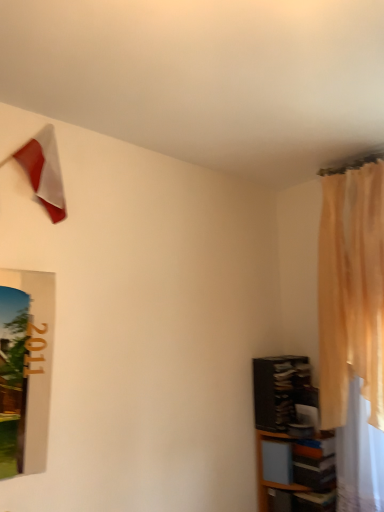
In order to click on black glossy shelf at lower right, placed as the 1th shelf when sorted from top to bottom in this screenshot , I will do `click(281, 390)`.

What do you see at coordinates (44, 170) in the screenshot?
I see `matte red flag at upper left` at bounding box center [44, 170].

I want to click on light beige sheer curtain at right, so click(351, 291).

Image resolution: width=384 pixels, height=512 pixels. In order to click on black glossy shelf at lower right, which is counted as the second shelf, starting from the bottom in this screenshot , I will do `click(281, 390)`.

Is the position of wooden shelf at lower right, the 1th shelf from the bottom, more distant than that of matte red flag at upper left?

Yes, wooden shelf at lower right, the 1th shelf from the bottom, is further from the camera.

The image size is (384, 512). In order to click on shelf that is the 2nd one when counting rightward from the matte red flag at upper left in this screenshot , I will do `click(291, 438)`.

Does point (272, 375) lie behind point (38, 135)?

Yes, point (272, 375) is farther from viewer.

From a real-world perspective, which object stands above the other?

matte red flag at upper left.

Based on their sizes in the image, would you say light beige sheer curtain at right is bigger or smaller than wooden shelf at lower right, the 1th shelf from the bottom?

Clearly, light beige sheer curtain at right is larger in size than wooden shelf at lower right, the 1th shelf from the bottom.

From the image's perspective, between light beige sheer curtain at right and wooden shelf at lower right, the 1th shelf from the bottom, who is located below?

From the image's view, wooden shelf at lower right, the 1th shelf from the bottom, is below.

Is light beige sheer curtain at right not close to wooden shelf at lower right, marked as the second shelf in a top-to-bottom arrangement?

No.

Which object is positioned more to the right, light beige sheer curtain at right or wooden shelf at lower right, the 1th shelf from the bottom?

light beige sheer curtain at right is more to the right.

Considering the positions of objects black glossy shelf at lower right, which is counted as the second shelf, starting from the bottom, and wooden shelf at lower right, the 1th shelf from the bottom, in the image provided, who is more to the right, black glossy shelf at lower right, which is counted as the second shelf, starting from the bottom, or wooden shelf at lower right, the 1th shelf from the bottom,?

wooden shelf at lower right, the 1th shelf from the bottom, is more to the right.

From the image's perspective, is black glossy shelf at lower right, placed as the 1th shelf when sorted from top to bottom, above wooden shelf at lower right, marked as the second shelf in a top-to-bottom arrangement?

Yes, from the image's perspective, black glossy shelf at lower right, placed as the 1th shelf when sorted from top to bottom, is above wooden shelf at lower right, marked as the second shelf in a top-to-bottom arrangement.

From a real-world perspective, between black glossy shelf at lower right, placed as the 1th shelf when sorted from top to bottom, and wooden shelf at lower right, the 1th shelf from the bottom, who is vertically lower?

wooden shelf at lower right, the 1th shelf from the bottom, from a real-world perspective.

Is black glossy shelf at lower right, placed as the 1th shelf when sorted from top to bottom, next to wooden shelf at lower right, marked as the second shelf in a top-to-bottom arrangement, and touching it?

Yes, black glossy shelf at lower right, placed as the 1th shelf when sorted from top to bottom, is next to wooden shelf at lower right, marked as the second shelf in a top-to-bottom arrangement.

Considering the relative sizes of light beige sheer curtain at right and black glossy shelf at lower right, placed as the 1th shelf when sorted from top to bottom, in the image provided, is light beige sheer curtain at right bigger than black glossy shelf at lower right, placed as the 1th shelf when sorted from top to bottom,?

Yes.

Considering the sizes of objects light beige sheer curtain at right and black glossy shelf at lower right, which is counted as the second shelf, starting from the bottom, in the image provided, who is thinner, light beige sheer curtain at right or black glossy shelf at lower right, which is counted as the second shelf, starting from the bottom,?

light beige sheer curtain at right is thinner.

Considering the sizes of light beige sheer curtain at right and black glossy shelf at lower right, which is counted as the second shelf, starting from the bottom, in the image, is light beige sheer curtain at right taller or shorter than black glossy shelf at lower right, which is counted as the second shelf, starting from the bottom,?

Clearly, light beige sheer curtain at right is taller compared to black glossy shelf at lower right, which is counted as the second shelf, starting from the bottom.

Visually, is light beige sheer curtain at right positioned to the left or to the right of black glossy shelf at lower right, placed as the 1th shelf when sorted from top to bottom?

Clearly, light beige sheer curtain at right is on the right of black glossy shelf at lower right, placed as the 1th shelf when sorted from top to bottom, in the image.

From the picture: Considering the positions of objects matte red flag at upper left and light beige sheer curtain at right in the image provided, who is more to the right, matte red flag at upper left or light beige sheer curtain at right?

light beige sheer curtain at right is more to the right.

Can you confirm if matte red flag at upper left is thinner than light beige sheer curtain at right?

Yes.

Does matte red flag at upper left have a smaller size compared to light beige sheer curtain at right?

Yes.

Which object is positioned more to the left, wooden shelf at lower right, the 1th shelf from the bottom, or light beige sheer curtain at right?

Positioned to the left is wooden shelf at lower right, the 1th shelf from the bottom.

Is wooden shelf at lower right, the 1th shelf from the bottom, spatially inside light beige sheer curtain at right, or outside of it?

wooden shelf at lower right, the 1th shelf from the bottom, is spatially situated outside light beige sheer curtain at right.

Could you measure the distance between wooden shelf at lower right, the 1th shelf from the bottom, and light beige sheer curtain at right?

wooden shelf at lower right, the 1th shelf from the bottom, is 17.07 inches from light beige sheer curtain at right.

Can you confirm if light beige sheer curtain at right is wider than matte red flag at upper left?

Yes.

Is light beige sheer curtain at right not close to matte red flag at upper left?

Absolutely, light beige sheer curtain at right is distant from matte red flag at upper left.

Visually, is light beige sheer curtain at right positioned to the left or to the right of matte red flag at upper left?

Clearly, light beige sheer curtain at right is on the right of matte red flag at upper left in the image.

Consider the image. Does light beige sheer curtain at right have a larger size compared to matte red flag at upper left?

Yes.

Where is `flag that is in front of the wooden shelf at lower right, marked as the second shelf in a top-to-bottom arrangement`? The image size is (384, 512). flag that is in front of the wooden shelf at lower right, marked as the second shelf in a top-to-bottom arrangement is located at coordinates (44, 170).

This screenshot has width=384, height=512. Find the location of `shelf that is the 1st object to the left of the light beige sheer curtain at right, starting at the anchor`. shelf that is the 1st object to the left of the light beige sheer curtain at right, starting at the anchor is located at coordinates (291, 438).

Looking at the image, which one is located further to black glossy shelf at lower right, placed as the 1th shelf when sorted from top to bottom, light beige sheer curtain at right or wooden shelf at lower right, marked as the second shelf in a top-to-bottom arrangement?

light beige sheer curtain at right.

Based on their spatial positions, is matte red flag at upper left or light beige sheer curtain at right closer to black glossy shelf at lower right, placed as the 1th shelf when sorted from top to bottom?

light beige sheer curtain at right.

Which object lies further to the anchor point light beige sheer curtain at right, wooden shelf at lower right, marked as the second shelf in a top-to-bottom arrangement, or matte red flag at upper left?

Among the two, matte red flag at upper left is located further to light beige sheer curtain at right.

Based on their spatial positions, is black glossy shelf at lower right, which is counted as the second shelf, starting from the bottom, or matte red flag at upper left closer to wooden shelf at lower right, marked as the second shelf in a top-to-bottom arrangement?

Based on the image, black glossy shelf at lower right, which is counted as the second shelf, starting from the bottom, appears to be nearer to wooden shelf at lower right, marked as the second shelf in a top-to-bottom arrangement.

Which object lies further to the anchor point matte red flag at upper left, light beige sheer curtain at right or wooden shelf at lower right, marked as the second shelf in a top-to-bottom arrangement?

wooden shelf at lower right, marked as the second shelf in a top-to-bottom arrangement, is further to matte red flag at upper left.

Based on their spatial positions, is matte red flag at upper left or light beige sheer curtain at right further from wooden shelf at lower right, marked as the second shelf in a top-to-bottom arrangement?

matte red flag at upper left is further to wooden shelf at lower right, marked as the second shelf in a top-to-bottom arrangement.

When comparing their distances from light beige sheer curtain at right, does black glossy shelf at lower right, placed as the 1th shelf when sorted from top to bottom, or wooden shelf at lower right, the 1th shelf from the bottom, seem further?

black glossy shelf at lower right, placed as the 1th shelf when sorted from top to bottom, is further to light beige sheer curtain at right.

Based on their spatial positions, is black glossy shelf at lower right, which is counted as the second shelf, starting from the bottom, or matte red flag at upper left further from light beige sheer curtain at right?

matte red flag at upper left lies further to light beige sheer curtain at right than the other object.

Find the location of a particular element. shelf between matte red flag at upper left and wooden shelf at lower right, marked as the second shelf in a top-to-bottom arrangement, vertically is located at coordinates (281, 390).

Where is `shelf that lies between light beige sheer curtain at right and wooden shelf at lower right, the 1th shelf from the bottom, from top to bottom`? shelf that lies between light beige sheer curtain at right and wooden shelf at lower right, the 1th shelf from the bottom, from top to bottom is located at coordinates (281, 390).